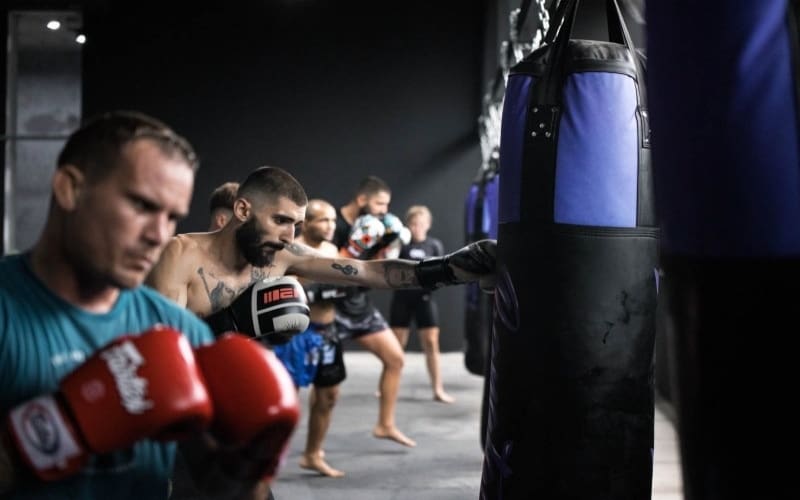
What are the coordinates of `floor` in the screenshot? It's located at (426, 469).